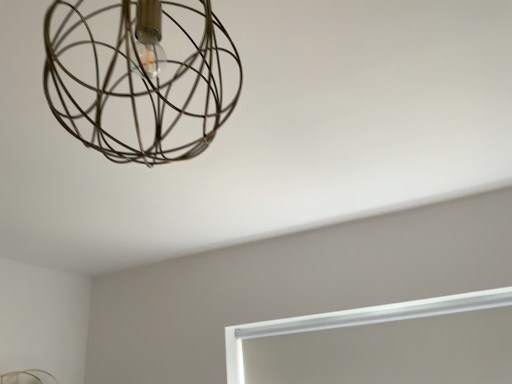
What do you see at coordinates (140, 76) in the screenshot?
I see `metallic wire sphere at upper left` at bounding box center [140, 76].

Where is `metallic wire sphere at upper left`? This screenshot has width=512, height=384. metallic wire sphere at upper left is located at coordinates (140, 76).

In order to click on metallic wire sphere at upper left in this screenshot , I will do `click(140, 76)`.